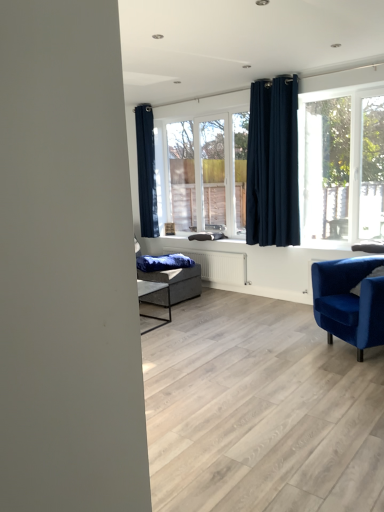
The image size is (384, 512). I want to click on vacant point above dark blue velvet curtain at upper center, which is counted as the first curtain, starting from the right (from a real-world perspective), so click(x=283, y=69).